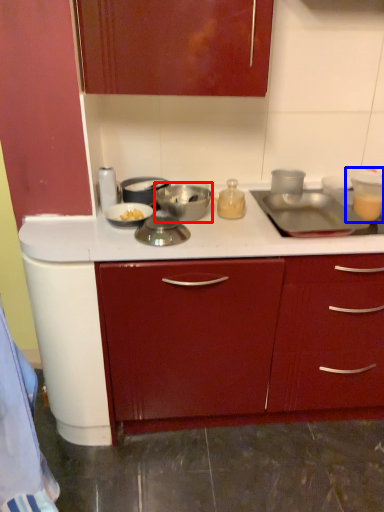
Question: Which of the following is the farthest to the observer, kitchen appliance (highlighted by a red box) or appliance (highlighted by a blue box)?

Choices:
 (A) kitchen appliance
 (B) appliance

Answer: (B)